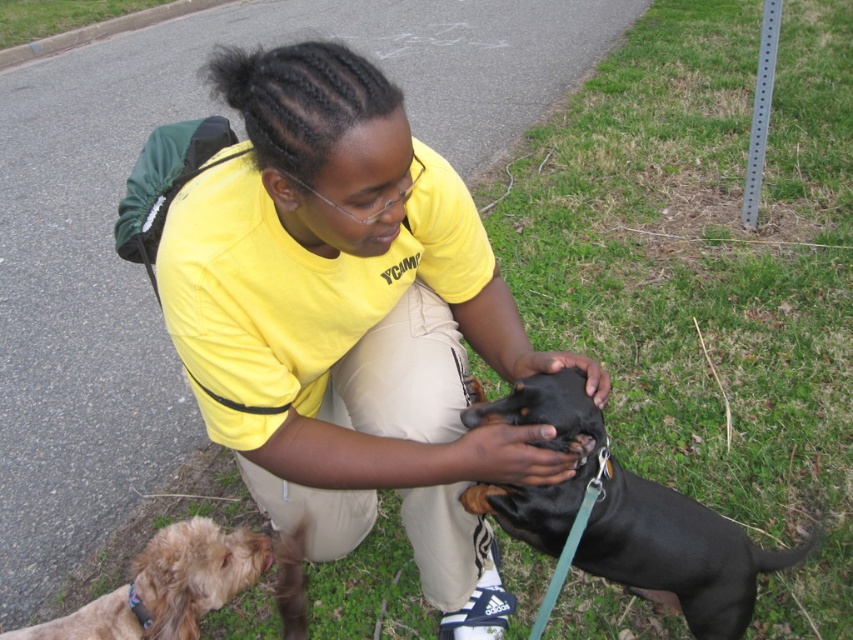
Is black smooth dog at center further to camera compared to light brown fur at lower left?

No, black smooth dog at center is closer to the viewer.

Find the location of a particular element. Image resolution: width=853 pixels, height=640 pixels. black smooth dog at center is located at coordinates (677, 552).

Between point (320, 157) and point (689, 506), which one is positioned behind?

The point (689, 506) is more distant.

Is point (416, 294) in front of point (747, 572)?

No, it is behind (747, 572).

You are a GUI agent. You are given a task and a screenshot of the screen. Output one action in this format:
    pyautogui.click(x=<x>, y=<y>)
    Task: Click on the yellow cotton shirt at center
    The height and width of the screenshot is (640, 853).
    Given the screenshot: What is the action you would take?
    (x=350, y=321)

Does yellow cotton shirt at center appear on the left side of light brown fur at lower left?

In fact, yellow cotton shirt at center is to the right of light brown fur at lower left.

Who is more forward, (430, 458) or (303, 532)?

Point (430, 458) is in front.

Between point (280, 230) and point (192, 628), which one is positioned in front?

Point (280, 230) is in front.

Locate an element on the screen. Image resolution: width=853 pixels, height=640 pixels. yellow cotton shirt at center is located at coordinates (x=350, y=321).